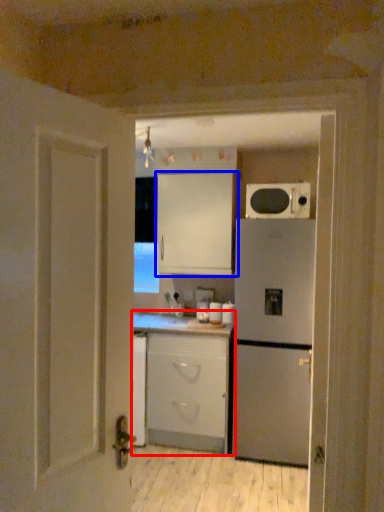
Question: Which of the following is the farthest to the observer, cabinetry (highlighted by a red box) or cabinetry (highlighted by a blue box)?

Choices:
 (A) cabinetry
 (B) cabinetry

Answer: (B)